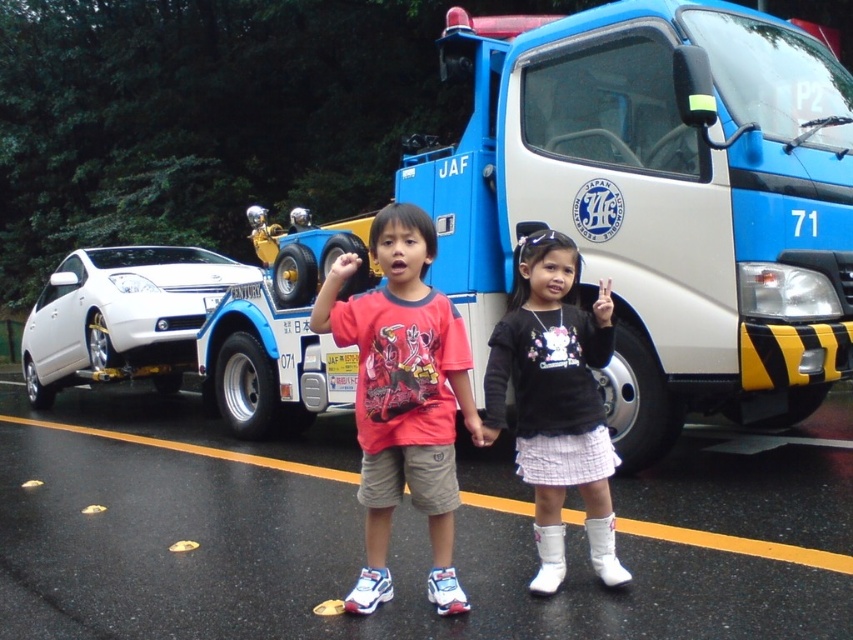
You are a photographer trying to capture the blue metallic tow truck at center in your shot. The camera you are using has a rectangular viewfinder with a coordinate system where the bottom left corner is the origin point. The coordinates of the tow truck are marked at point (656, 200). Where should you position your camera to ensure the tow truck is centered in the viewfinder?

The coordinates of the blue metallic tow truck at center are marked at point (656, 200). To center it in the viewfinder, align the camera so that the point (656, 200) is exactly at the center of the viewfinder.

You are a photographer trying to capture a photo of the blue metallic tow truck at center and the white matte boots at lower center. To ensure both are in frame, you need to know their relative positions. Which object is located to the right of the other?

The blue metallic tow truck at center is positioned on the right side of white matte boots at lower center, so the tow truck is to the right of the boots.